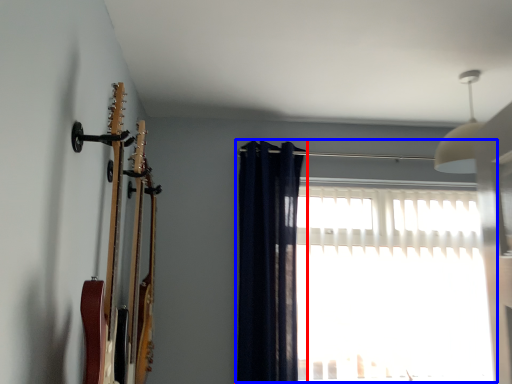
Question: Which of the following is the closest to the observer, curtain (highlighted by a red box) or window (highlighted by a blue box)?

Choices:
 (A) curtain
 (B) window

Answer: (A)